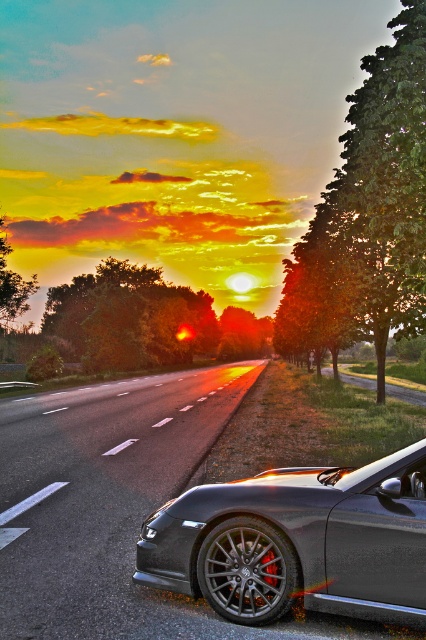
Question: Can you confirm if smooth asphalt highway at center is wider than satin black car at center?

Choices:
 (A) yes
 (B) no

Answer: (A)

Question: Is smooth asphalt highway at center positioned before satin black car at center?

Choices:
 (A) yes
 (B) no

Answer: (B)

Question: Which point appears closest to the camera in this image?

Choices:
 (A) (313, 579)
 (B) (3, 621)

Answer: (A)

Question: In this image, where is smooth asphalt highway at center located relative to satin black car at center?

Choices:
 (A) above
 (B) below

Answer: (B)